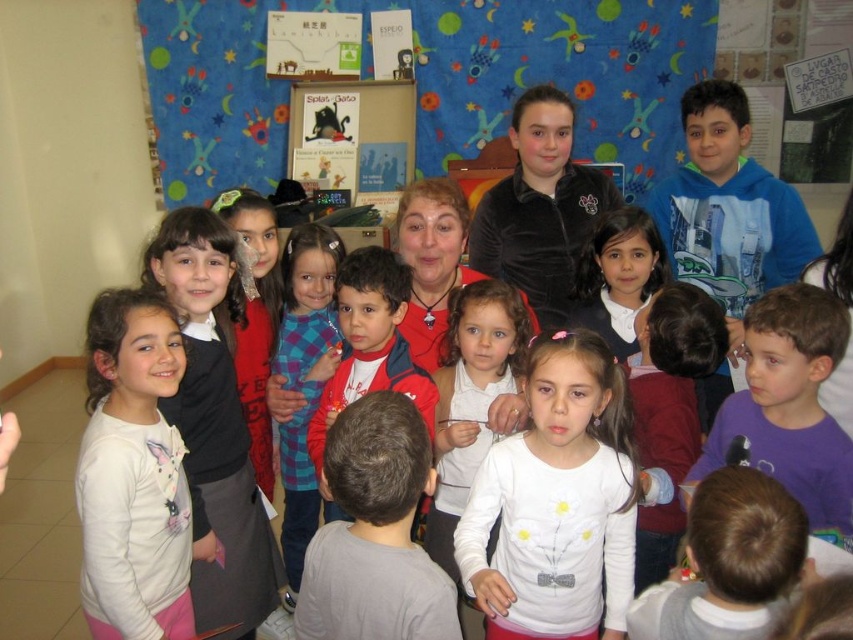
Based on the photo, does white soft shirt at left have a lesser height compared to red fleece jacket at center?

Incorrect, white soft shirt at left's height does not fall short of red fleece jacket at center's.

This screenshot has width=853, height=640. I want to click on white soft shirt at left, so [x=132, y=474].

Is point (531, 564) closer to viewer compared to point (288, 563)?

Yes, point (531, 564) is closer to viewer.

Describe the element at coordinates (556, 502) in the screenshot. Image resolution: width=853 pixels, height=640 pixels. I see `white matte shirt at center` at that location.

Where is `white matte shirt at center`? Image resolution: width=853 pixels, height=640 pixels. white matte shirt at center is located at coordinates (556, 502).

Is white matte shirt at center taller than red fleece jacket at center?

Indeed, white matte shirt at center has a greater height compared to red fleece jacket at center.

Between point (567, 531) and point (306, 435), which one is positioned behind?

The point (306, 435) is more distant.

Between point (520, 470) and point (402, 289), which one is positioned behind?

Point (402, 289)

Identify the location of white matte shirt at center. The image size is (853, 640). (556, 502).